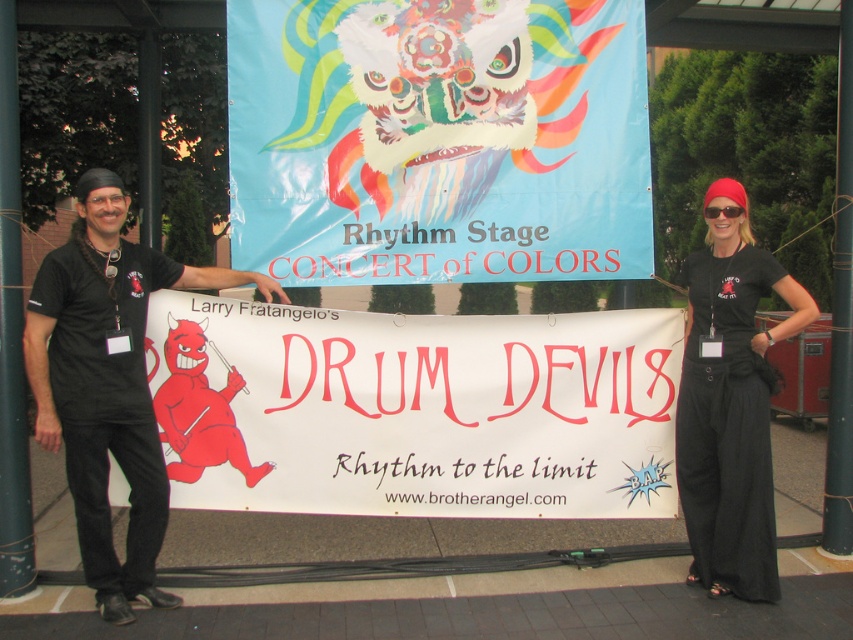
Identify the location of white paper banner at center. (415, 410).

Measure the distance between point (x=221, y=468) and camera.

A distance of 4.46 meters exists between point (x=221, y=468) and camera.

Find the location of a particular element. The height and width of the screenshot is (640, 853). white paper banner at center is located at coordinates (415, 410).

Between point (509, 154) and point (732, 209), which one is positioned in front?

Positioned in front is point (732, 209).

Who is higher up, turquoise glossy banner at center or black plastic goggles at upper center?

Positioned higher is turquoise glossy banner at center.

Between point (262, 10) and point (740, 208), which one is positioned behind?

Positioned behind is point (262, 10).

This screenshot has height=640, width=853. I want to click on turquoise glossy banner at center, so click(438, 138).

Is point (398, 266) positioned after point (701, 548)?

Yes, point (398, 266) is farther from viewer.

Between turquoise glossy banner at center and black cotton t-shirt at center, which one is positioned higher?

Positioned higher is turquoise glossy banner at center.

Image resolution: width=853 pixels, height=640 pixels. What are the coordinates of `turquoise glossy banner at center` in the screenshot? It's located at (438, 138).